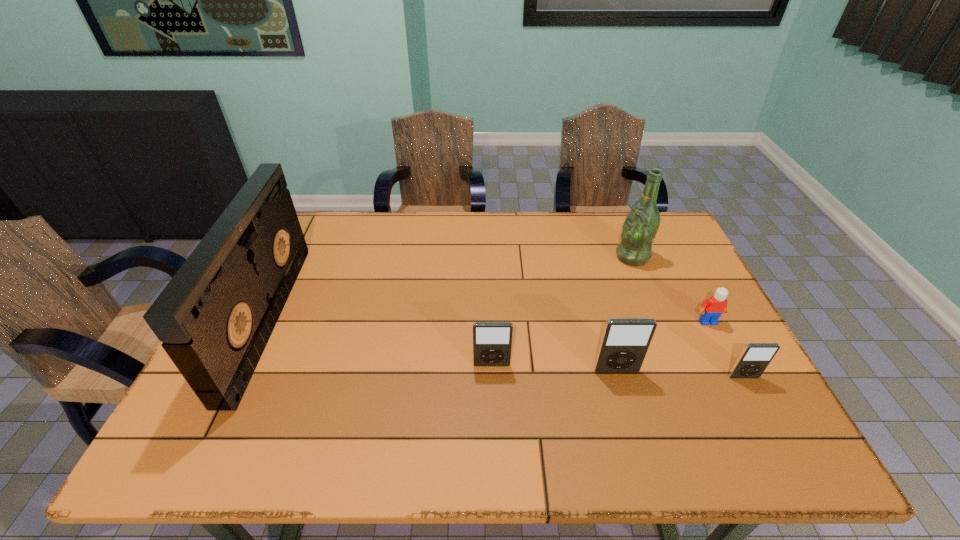
Locate an element on the screen. This screenshot has height=540, width=960. the second shortest iPod is located at coordinates (492, 341).

Find the location of a particular element. The height and width of the screenshot is (540, 960). the leftmost iPod is located at coordinates tap(492, 341).

Locate an element on the screen. the tallest iPod is located at coordinates (625, 341).

The height and width of the screenshot is (540, 960). In order to click on the third object from left to right in this screenshot , I will do `click(625, 341)`.

The image size is (960, 540). I want to click on the shortest iPod, so click(x=755, y=357).

The height and width of the screenshot is (540, 960). What are the coordinates of `the nearest iPod` in the screenshot? It's located at (755, 357).

Locate an element on the screen. The height and width of the screenshot is (540, 960). the third object from right to left is located at coordinates (640, 227).

Identify the location of Lego. The height and width of the screenshot is (540, 960). (712, 308).

Locate an element on the screen. The image size is (960, 540). videotape is located at coordinates (215, 317).

Locate an element on the screen. The width and height of the screenshot is (960, 540). vacant space located on the front-facing side of the second object from left to right is located at coordinates (492, 388).